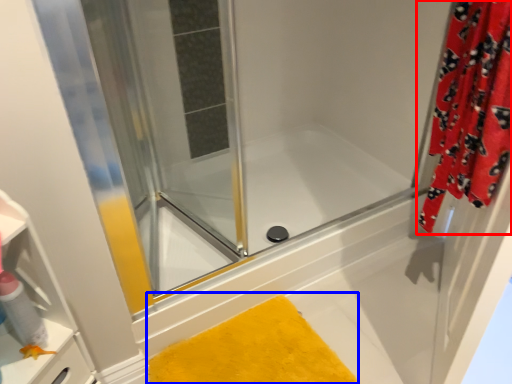
Question: Which of the following is the farthest to the observer, curtain (highlighted by a red box) or bath mat (highlighted by a blue box)?

Choices:
 (A) curtain
 (B) bath mat

Answer: (B)